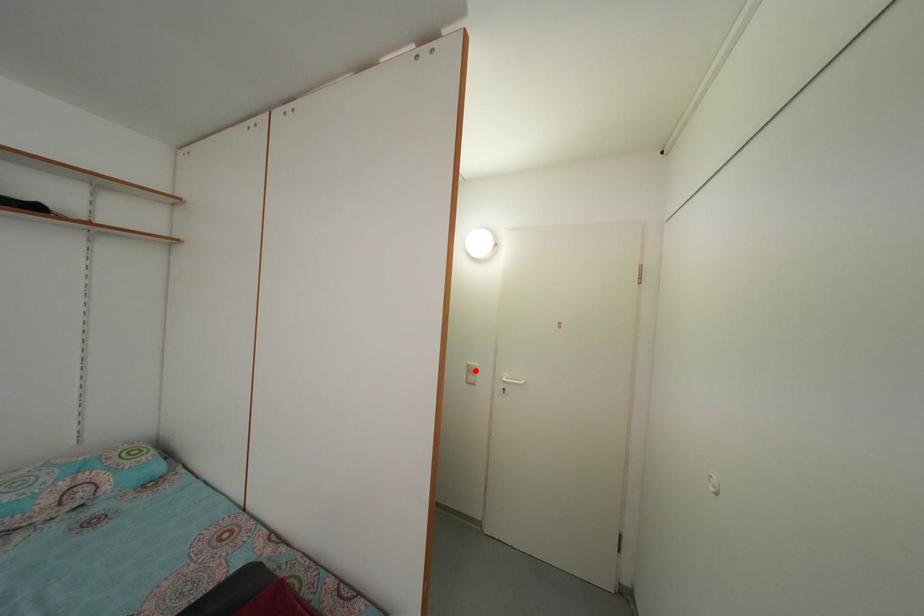
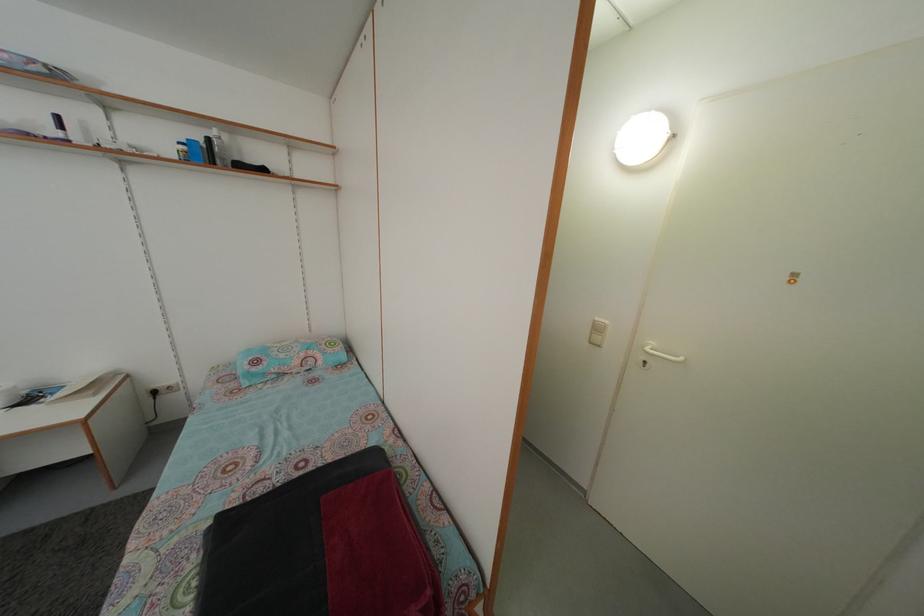
In the second image, find the point that corresponds to the highlighted location in the first image.

(602, 326)